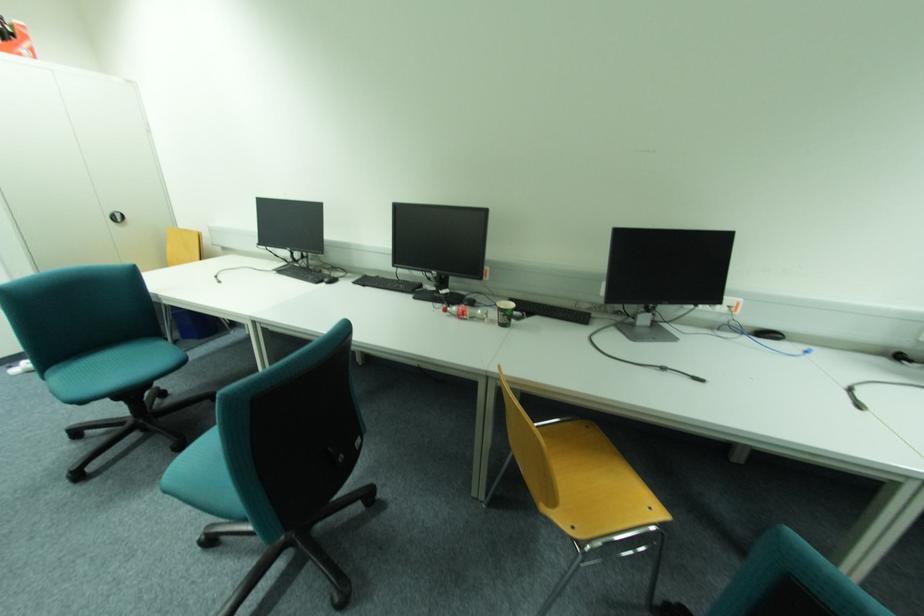
Locate an element on the screen. This screenshot has width=924, height=616. recessed cabinet handle is located at coordinates (118, 220).